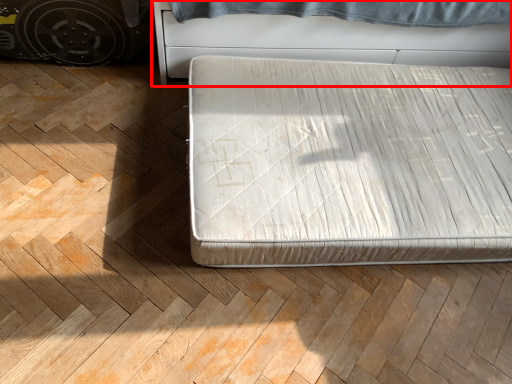
Question: From the image's perspective, where is furniture (annotated by the red box) located relative to bed?

Choices:
 (A) above
 (B) below

Answer: (A)